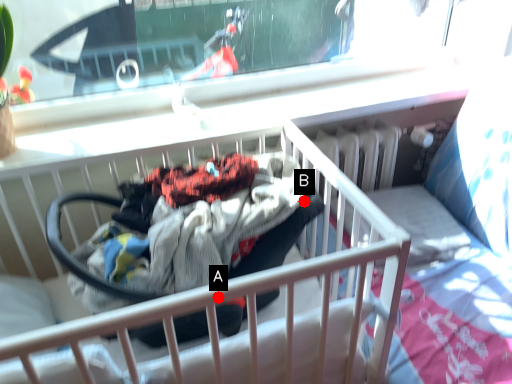
Question: Two points are circled on the image, labeled by A and B beside each circle. Among these points, which one is nearest to the camera?

Choices:
 (A) A is closer
 (B) B is closer

Answer: (A)